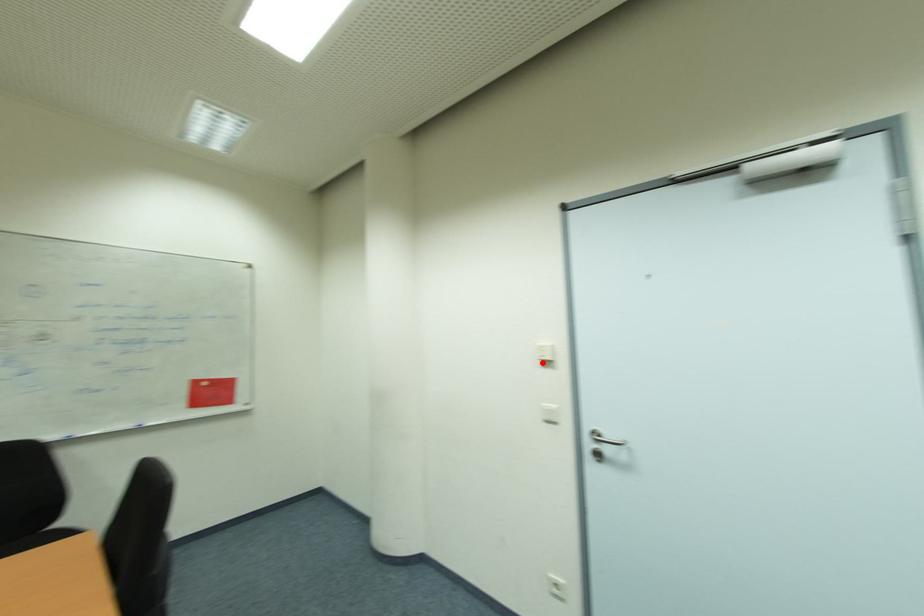
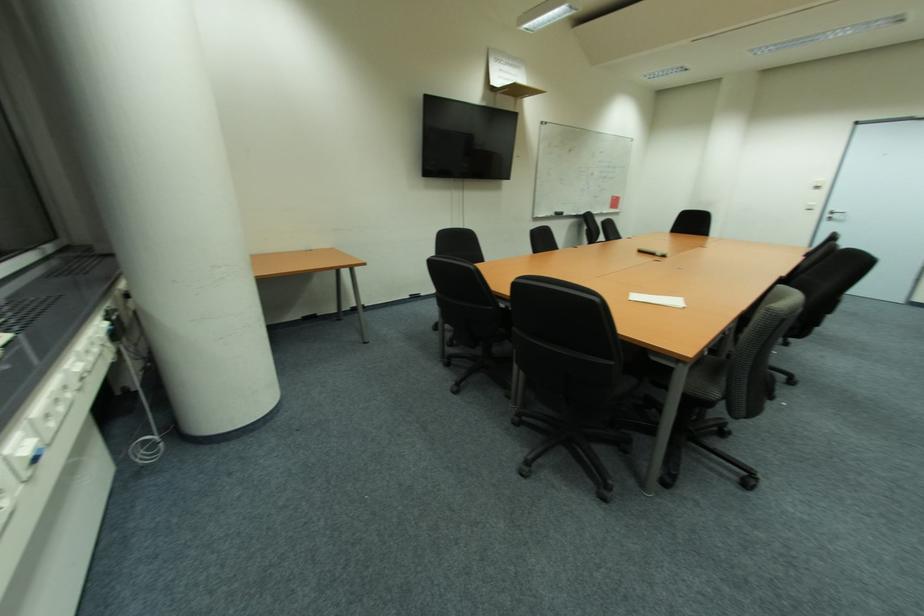
Find the pixel in the second image that matches the highlighted location in the first image.

(820, 188)